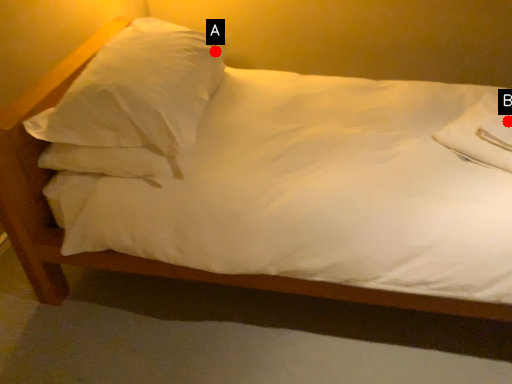
Question: Two points are circled on the image, labeled by A and B beside each circle. Among these points, which one is nearest to the camera?

Choices:
 (A) A is closer
 (B) B is closer

Answer: (B)